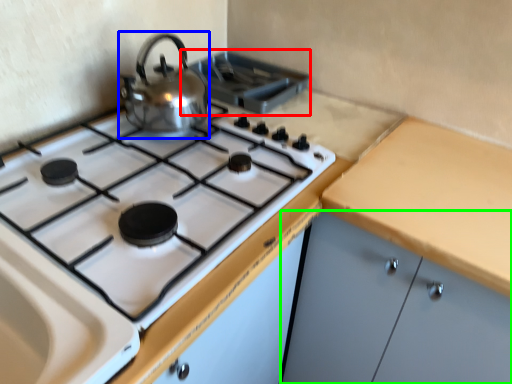
Question: Based on their relative distances, which object is nearer to appliance (highlighted by a red box)? Choose from kitchen appliance (highlighted by a blue box) and cabinetry (highlighted by a green box).

Choices:
 (A) kitchen appliance
 (B) cabinetry

Answer: (A)